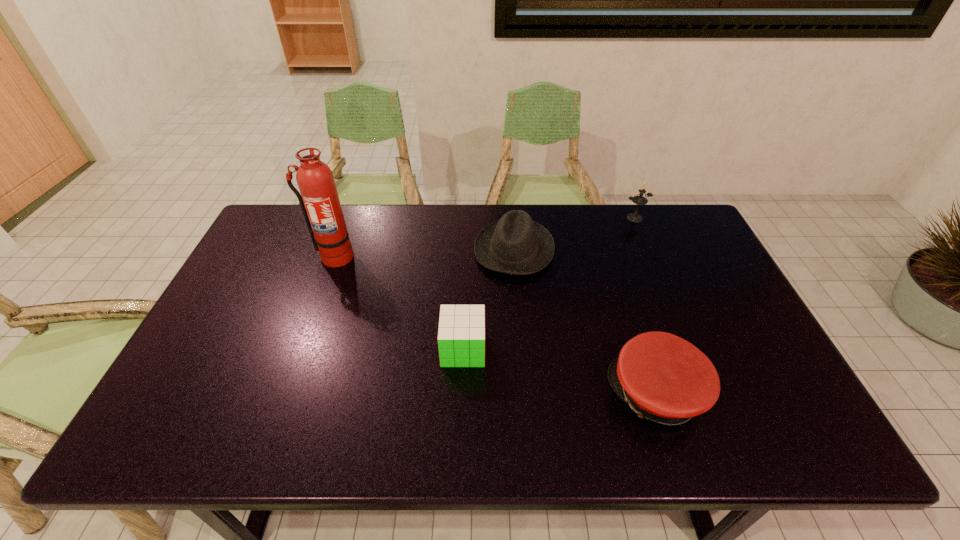
Where is `vacant space located 0.070m on the right of the cube`? The height and width of the screenshot is (540, 960). vacant space located 0.070m on the right of the cube is located at coordinates (512, 349).

At what (x,y) coordinates should I click in order to perform the action: click on vacant space located 0.120m on the front-facing side of the cap. Please return your answer as a coordinate pair (x, y). This screenshot has width=960, height=540. Looking at the image, I should click on click(560, 393).

In order to click on free space located on the front-facing side of the cap in this screenshot , I will do `click(505, 393)`.

Image resolution: width=960 pixels, height=540 pixels. I want to click on free space located on the front-facing side of the cap, so click(x=467, y=393).

This screenshot has height=540, width=960. In order to click on fire extinguisher located at the far edge in this screenshot , I will do `click(319, 200)`.

Locate an element on the screen. candle holder that is at the far edge is located at coordinates [x=639, y=200].

At what (x,y) coordinates should I click in order to perform the action: click on fedora that is positioned at the far edge. Please return your answer as a coordinate pair (x, y). Image resolution: width=960 pixels, height=540 pixels. Looking at the image, I should click on (515, 245).

Locate an element on the screen. The height and width of the screenshot is (540, 960). object present at the near edge is located at coordinates (662, 377).

In order to click on object present at the right edge in this screenshot , I will do `click(639, 200)`.

Locate an element on the screen. The image size is (960, 540). object that is at the far right corner is located at coordinates (639, 200).